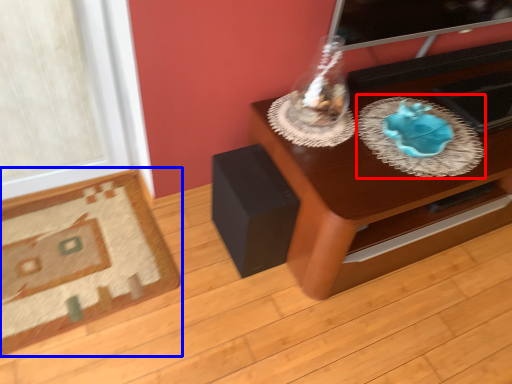
Question: Which object is further to the camera taking this photo, glass plate (highlighted by a red box) or furniture (highlighted by a blue box)?

Choices:
 (A) glass plate
 (B) furniture

Answer: (B)